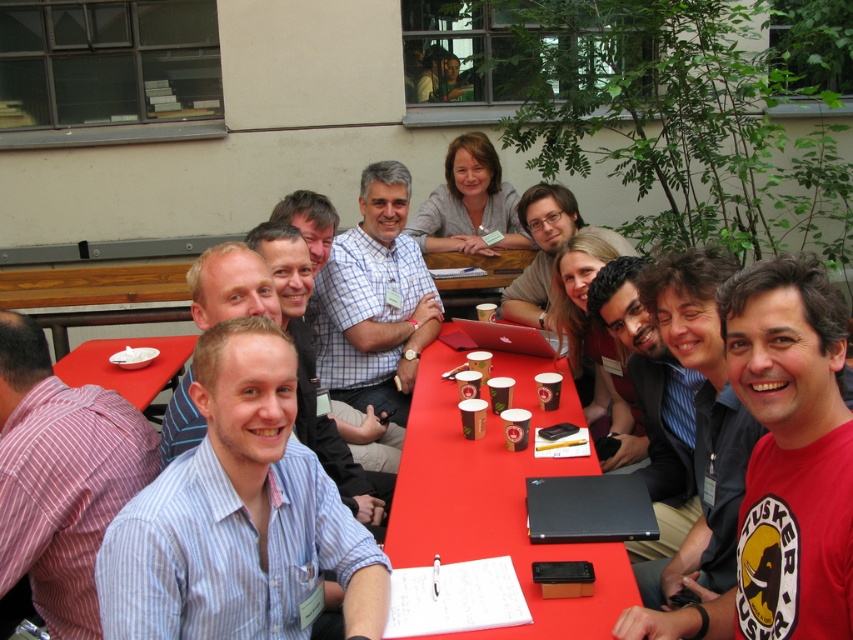
Can you confirm if red cotton t-shirt at center is positioned below white checkered shirt at center?

Indeed, red cotton t-shirt at center is positioned under white checkered shirt at center.

Can you confirm if red cotton t-shirt at center is thinner than white checkered shirt at center?

Correct, red cotton t-shirt at center's width is less than white checkered shirt at center's.

This screenshot has height=640, width=853. Describe the element at coordinates (784, 461) in the screenshot. I see `red cotton t-shirt at center` at that location.

At what (x,y) coordinates should I click in order to perform the action: click on red cotton t-shirt at center. Please return your answer as a coordinate pair (x, y). The width and height of the screenshot is (853, 640). Looking at the image, I should click on (784, 461).

Is blue striped shirt at center positioned before white checkered shirt at center?

That is True.

Is blue striped shirt at center below white checkered shirt at center?

Yes, blue striped shirt at center is below white checkered shirt at center.

Image resolution: width=853 pixels, height=640 pixels. In order to click on blue striped shirt at center in this screenshot , I will do `click(238, 515)`.

Is red matte table at center to the right of light brown hair at center from the viewer's perspective?

Indeed, red matte table at center is positioned on the right side of light brown hair at center.

Image resolution: width=853 pixels, height=640 pixels. What do you see at coordinates (495, 499) in the screenshot?
I see `red matte table at center` at bounding box center [495, 499].

Who is more distant from viewer, (428,422) or (279,212)?

The point (279,212) is behind.

Find the location of a particular element. red matte table at center is located at coordinates (495, 499).